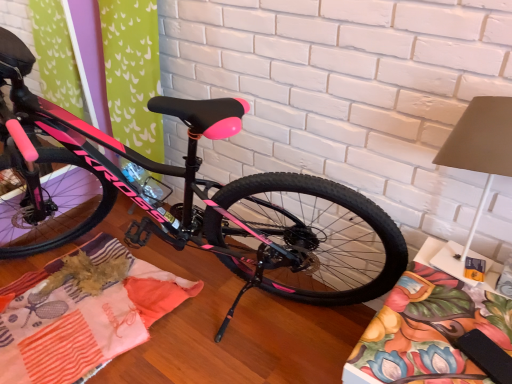
Question: Is floral fabric cushion at lower right, arranged as the first blanket when viewed from the right, positioned behind patchwork fabric at center, which appears as the first blanket when viewed from the left?

Choices:
 (A) yes
 (B) no

Answer: (B)

Question: Is patchwork fabric at center, which appears as the first blanket when viewed from the left, surrounded by floral fabric cushion at lower right, arranged as the first blanket when viewed from the right?

Choices:
 (A) yes
 (B) no

Answer: (B)

Question: Are floral fabric cushion at lower right, which appears as the 2th blanket when viewed from the left, and patchwork fabric at center, which is counted as the second blanket, starting from the right, beside each other?

Choices:
 (A) no
 (B) yes

Answer: (A)

Question: Is floral fabric cushion at lower right, which appears as the 2th blanket when viewed from the left, completely or partially outside of patchwork fabric at center, which is counted as the second blanket, starting from the right?

Choices:
 (A) no
 (B) yes

Answer: (B)

Question: From a real-world perspective, is floral fabric cushion at lower right, arranged as the first blanket when viewed from the right, positioned over patchwork fabric at center, which is counted as the second blanket, starting from the right, based on gravity?

Choices:
 (A) yes
 (B) no

Answer: (A)

Question: Considering the positions of floral fabric cushion at lower right, which appears as the 2th blanket when viewed from the left, and pink glossy bicycle at center in the image, is floral fabric cushion at lower right, which appears as the 2th blanket when viewed from the left, taller or shorter than pink glossy bicycle at center?

Choices:
 (A) short
 (B) tall

Answer: (A)

Question: In terms of size, does floral fabric cushion at lower right, arranged as the first blanket when viewed from the right, appear bigger or smaller than pink glossy bicycle at center?

Choices:
 (A) small
 (B) big

Answer: (A)

Question: Visually, is floral fabric cushion at lower right, which appears as the 2th blanket when viewed from the left, positioned to the left or to the right of pink glossy bicycle at center?

Choices:
 (A) left
 (B) right

Answer: (B)

Question: Does point (484, 377) appear closer or farther from the camera than point (22, 57)?

Choices:
 (A) farther
 (B) closer

Answer: (B)

Question: Considering their positions, is patchwork fabric at center, which appears as the first blanket when viewed from the left, located in front of or behind floral fabric cushion at lower right, which appears as the 2th blanket when viewed from the left?

Choices:
 (A) front
 (B) behind

Answer: (B)

Question: From the image's perspective, relative to floral fabric cushion at lower right, which appears as the 2th blanket when viewed from the left, is patchwork fabric at center, which appears as the first blanket when viewed from the left, above or below?

Choices:
 (A) below
 (B) above

Answer: (B)

Question: Considering the relative positions of patchwork fabric at center, which is counted as the second blanket, starting from the right, and floral fabric cushion at lower right, arranged as the first blanket when viewed from the right, in the image provided, is patchwork fabric at center, which is counted as the second blanket, starting from the right, to the left or to the right of floral fabric cushion at lower right, arranged as the first blanket when viewed from the right,?

Choices:
 (A) right
 (B) left

Answer: (B)

Question: Looking at their shapes, would you say patchwork fabric at center, which is counted as the second blanket, starting from the right, is wider or thinner than floral fabric cushion at lower right, which appears as the 2th blanket when viewed from the left?

Choices:
 (A) wide
 (B) thin

Answer: (A)

Question: Considering the positions of pink glossy bicycle at center and floral fabric cushion at lower right, which appears as the 2th blanket when viewed from the left, in the image, is pink glossy bicycle at center taller or shorter than floral fabric cushion at lower right, which appears as the 2th blanket when viewed from the left,?

Choices:
 (A) tall
 (B) short

Answer: (A)

Question: From the image's perspective, is pink glossy bicycle at center above or below floral fabric cushion at lower right, which appears as the 2th blanket when viewed from the left?

Choices:
 (A) above
 (B) below

Answer: (A)